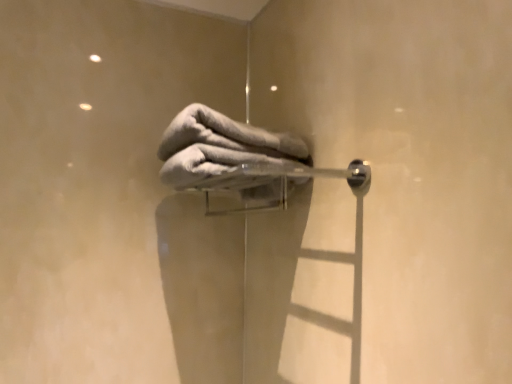
Question: Is gray soft towel at center next to satin silver towel rack at center and touching it?

Choices:
 (A) no
 (B) yes

Answer: (B)

Question: Can you confirm if gray soft towel at center is wider than satin silver towel rack at center?

Choices:
 (A) no
 (B) yes

Answer: (B)

Question: Is gray soft towel at center positioned in front of satin silver towel rack at center?

Choices:
 (A) no
 (B) yes

Answer: (A)

Question: Would you say gray soft towel at center contains satin silver towel rack at center?

Choices:
 (A) yes
 (B) no

Answer: (B)

Question: From the image's perspective, is gray soft towel at center over satin silver towel rack at center?

Choices:
 (A) no
 (B) yes

Answer: (B)

Question: From a real-world perspective, is gray soft towel at center under satin silver towel rack at center?

Choices:
 (A) yes
 (B) no

Answer: (B)

Question: From a real-world perspective, is satin silver towel rack at center positioned over gray soft towel at center based on gravity?

Choices:
 (A) no
 (B) yes

Answer: (A)

Question: Considering the relative positions of satin silver towel rack at center and gray soft towel at center in the image provided, is satin silver towel rack at center to the left of gray soft towel at center from the viewer's perspective?

Choices:
 (A) no
 (B) yes

Answer: (A)

Question: Is satin silver towel rack at center at the right side of gray soft towel at center?

Choices:
 (A) no
 (B) yes

Answer: (B)

Question: Is gray soft towel at center at the back of satin silver towel rack at center?

Choices:
 (A) yes
 (B) no

Answer: (B)

Question: From the image's perspective, is satin silver towel rack at center under gray soft towel at center?

Choices:
 (A) no
 (B) yes

Answer: (B)

Question: Considering the relative positions of satin silver towel rack at center and gray soft towel at center in the image provided, is satin silver towel rack at center behind gray soft towel at center?

Choices:
 (A) no
 (B) yes

Answer: (A)

Question: Do you think gray soft towel at center is within satin silver towel rack at center, or outside of it?

Choices:
 (A) outside
 (B) inside

Answer: (A)